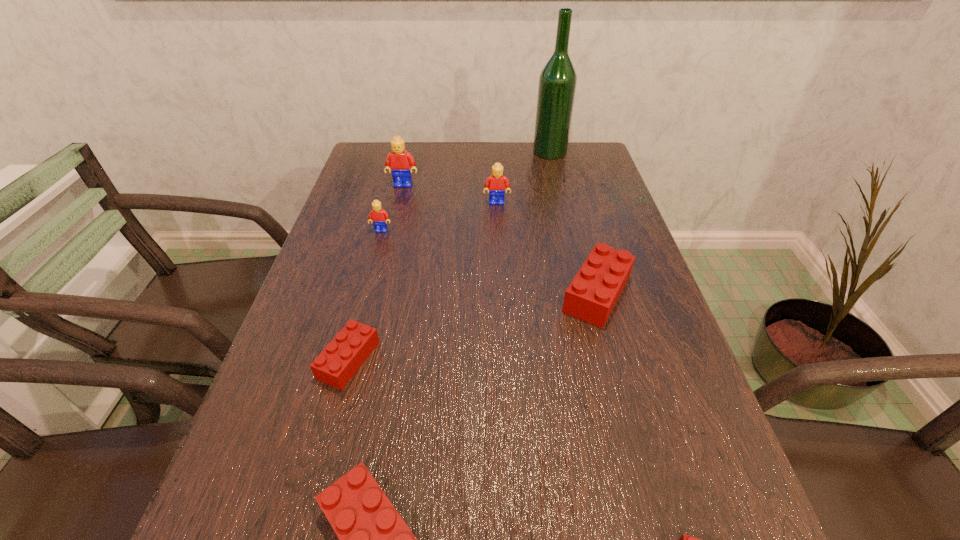
In order to click on alcohol in this screenshot , I will do `click(557, 84)`.

The height and width of the screenshot is (540, 960). What are the coordinates of `green alcohol` in the screenshot? It's located at (557, 84).

The width and height of the screenshot is (960, 540). Identify the location of the farthest yellow Lego. (399, 161).

Locate an element on the screen. The height and width of the screenshot is (540, 960). the seventh nearest object is located at coordinates (399, 161).

Locate an element on the screen. The image size is (960, 540). the fifth Lego from left to right is located at coordinates (496, 183).

At what (x,y) coordinates should I click in order to perform the action: click on the sixth shortest Lego. Please return your answer as a coordinate pair (x, y). This screenshot has height=540, width=960. Looking at the image, I should click on (496, 183).

Locate an element on the screen. the fifth nearest Lego is located at coordinates pos(379,217).

Find the location of a particular element. The width and height of the screenshot is (960, 540). the fifth shortest object is located at coordinates (379, 217).

This screenshot has height=540, width=960. Identify the location of the biggest red Lego. (591, 296).

Identify the location of the fourth farthest Lego. (591, 296).